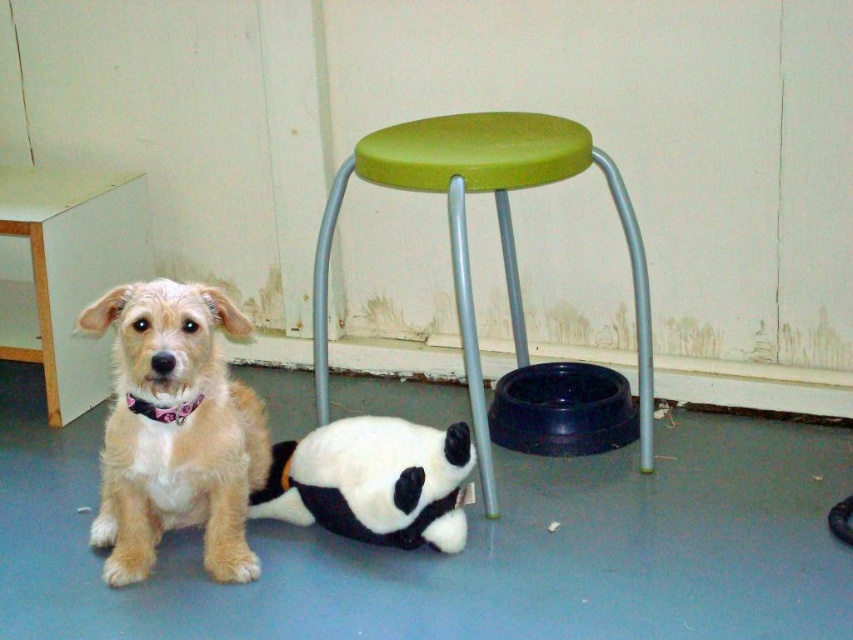
Question: Is fuzzy beige dog at lower left to the left of green plastic stool at upper center from the viewer's perspective?

Choices:
 (A) no
 (B) yes

Answer: (A)

Question: Does green plastic stool at center appear under soft plush panda at lower center?

Choices:
 (A) no
 (B) yes

Answer: (A)

Question: Which point is closer to the camera?

Choices:
 (A) fuzzy beige dog at lower left
 (B) soft plush panda at lower center
 (C) green plastic stool at upper center
 (D) green plastic stool at center

Answer: (A)

Question: Can you confirm if green plastic stool at center is positioned to the right of green plastic stool at upper center?

Choices:
 (A) yes
 (B) no

Answer: (A)

Question: Which object appears closest to the camera in this image?

Choices:
 (A) green plastic stool at center
 (B) soft plush panda at lower center
 (C) green plastic stool at upper center

Answer: (A)

Question: Among these points, which one is farthest from the camera?

Choices:
 (A) (107, 468)
 (B) (440, 161)
 (C) (410, 461)

Answer: (C)